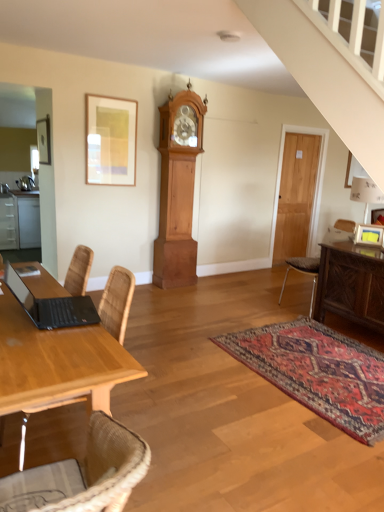
Question: Considering the relative sizes of wooden door at right and black matte laptop at lower left in the image provided, is wooden door at right shorter than black matte laptop at lower left?

Choices:
 (A) no
 (B) yes

Answer: (A)

Question: From the image's perspective, is wooden door at right over black matte laptop at lower left?

Choices:
 (A) yes
 (B) no

Answer: (A)

Question: Is wooden door at right next to black matte laptop at lower left?

Choices:
 (A) yes
 (B) no

Answer: (B)

Question: Is wooden door at right to the right of black matte laptop at lower left from the viewer's perspective?

Choices:
 (A) yes
 (B) no

Answer: (A)

Question: Considering the relative positions of wooden door at right and black matte laptop at lower left in the image provided, is wooden door at right behind black matte laptop at lower left?

Choices:
 (A) yes
 (B) no

Answer: (A)

Question: Is wooden door at right bigger or smaller than light brown wood grandfather clock at center?

Choices:
 (A) big
 (B) small

Answer: (B)

Question: From the image's perspective, is wooden door at right located above or below light brown wood grandfather clock at center?

Choices:
 (A) below
 (B) above

Answer: (B)

Question: Is wooden door at right to the left or to the right of light brown wood grandfather clock at center in the image?

Choices:
 (A) right
 (B) left

Answer: (A)

Question: Is wooden door at right inside the boundaries of light brown wood grandfather clock at center, or outside?

Choices:
 (A) inside
 (B) outside

Answer: (B)

Question: Is carved wood sideboard at right wider or thinner than brown leather chair at right?

Choices:
 (A) thin
 (B) wide

Answer: (A)

Question: From the image's perspective, relative to brown leather chair at right, is carved wood sideboard at right above or below?

Choices:
 (A) above
 (B) below

Answer: (B)

Question: From their relative heights in the image, would you say carved wood sideboard at right is taller or shorter than brown leather chair at right?

Choices:
 (A) short
 (B) tall

Answer: (A)

Question: Is point (339, 300) closer or farther from the camera than point (294, 264)?

Choices:
 (A) closer
 (B) farther

Answer: (A)

Question: From a real-world perspective, is wooden table at left positioned above or below wooden door at right?

Choices:
 (A) above
 (B) below

Answer: (B)

Question: Is point (87, 386) closer or farther from the camera than point (309, 215)?

Choices:
 (A) closer
 (B) farther

Answer: (A)